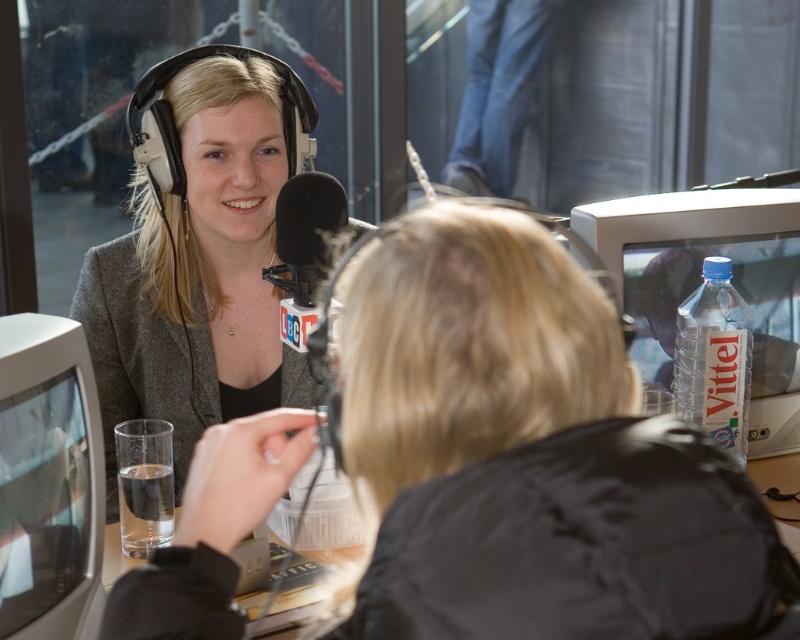
Is matte gray blazer at center taller than clear plastic monitor at upper right?

Indeed, matte gray blazer at center has a greater height compared to clear plastic monitor at upper right.

The image size is (800, 640). I want to click on matte gray blazer at center, so click(200, 259).

This screenshot has width=800, height=640. Identify the location of matte gray blazer at center. tap(200, 259).

The height and width of the screenshot is (640, 800). Find the location of `matte gray blazer at center`. matte gray blazer at center is located at coordinates (200, 259).

Is clear plastic monitor at upper right above white glossy computer monitor at left?

Indeed, clear plastic monitor at upper right is positioned over white glossy computer monitor at left.

Who is more distant from viewer, [612,228] or [52,593]?

Point [612,228]

Image resolution: width=800 pixels, height=640 pixels. Describe the element at coordinates (701, 280) in the screenshot. I see `clear plastic monitor at upper right` at that location.

Locate an element on the screen. This screenshot has width=800, height=640. clear plastic monitor at upper right is located at coordinates (701, 280).

Can you confirm if matte gray blazer at center is positioned to the right of black matte microphone at center?

No, matte gray blazer at center is not to the right of black matte microphone at center.

Is point (141, 232) positioned before point (292, 260)?

No, it is not.

What are the coordinates of `matte gray blazer at center` in the screenshot? It's located at (200, 259).